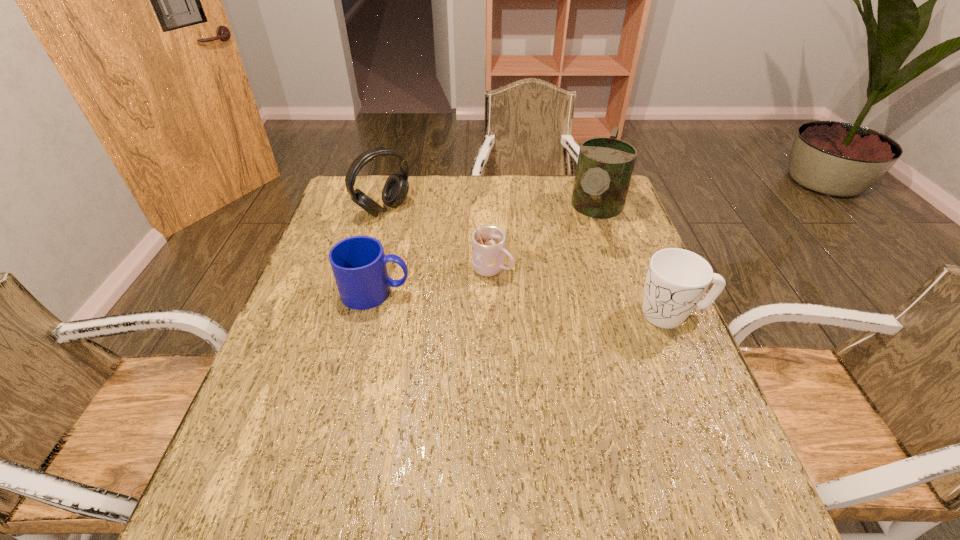
Where is `free space on the desktop that is between the left mug and the right mug and is positioned on the earcups of the second tallest object`? Image resolution: width=960 pixels, height=540 pixels. free space on the desktop that is between the left mug and the right mug and is positioned on the earcups of the second tallest object is located at coordinates (501, 301).

Where is `vacant space on the desktop that is between the shorter mug and the right mug and is positioned on the side with the handle of the cup`? This screenshot has height=540, width=960. vacant space on the desktop that is between the shorter mug and the right mug and is positioned on the side with the handle of the cup is located at coordinates (562, 306).

The image size is (960, 540). Identify the location of vacant space on the desktop that is between the left mug and the right mug and is positioned with the spout on the watering can. (562, 306).